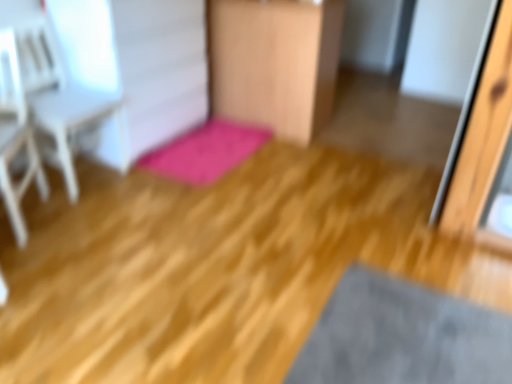
Question: In terms of width, does pink plush bath mat at center look wider or thinner when compared to wooden chair at center?

Choices:
 (A) wide
 (B) thin

Answer: (B)

Question: From the image's perspective, relative to wooden chair at center, is pink plush bath mat at center above or below?

Choices:
 (A) above
 (B) below

Answer: (B)

Question: Estimate the real-world distances between objects in this image. Which object is closer to the pink plush bath mat at center?

Choices:
 (A) white wood armchair at upper left, placed as the first armchair when sorted from back to front
 (B) wooden chair at center
 (C) white wood armchair at left, the 1th armchair from the front

Answer: (B)

Question: Which object is the farthest from the pink plush bath mat at center?

Choices:
 (A) white wood armchair at upper left, placed as the first armchair when sorted from back to front
 (B) white wood armchair at left, which is the 2th armchair from back to front
 (C) wooden chair at center

Answer: (B)